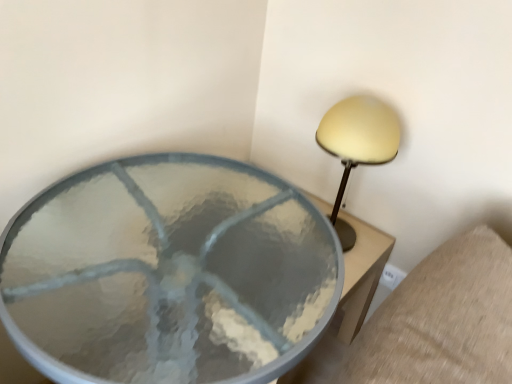
Question: Would you say clear glass table at center is to the left or to the right of matte yellow lampshade at upper right in the picture?

Choices:
 (A) right
 (B) left

Answer: (B)

Question: From a real-world perspective, is clear glass table at center positioned above or below matte yellow lampshade at upper right?

Choices:
 (A) above
 (B) below

Answer: (B)

Question: From their relative heights in the image, would you say clear glass table at center is taller or shorter than matte yellow lampshade at upper right?

Choices:
 (A) tall
 (B) short

Answer: (A)

Question: Looking at the image, does matte yellow lampshade at upper right seem bigger or smaller compared to clear glass table at center?

Choices:
 (A) big
 (B) small

Answer: (B)

Question: Relative to clear glass table at center, is matte yellow lampshade at upper right in front or behind?

Choices:
 (A) behind
 (B) front

Answer: (A)

Question: From a real-world perspective, is matte yellow lampshade at upper right above or below clear glass table at center?

Choices:
 (A) above
 (B) below

Answer: (A)

Question: Is point (369, 122) closer or farther from the camera than point (2, 241)?

Choices:
 (A) closer
 (B) farther

Answer: (B)